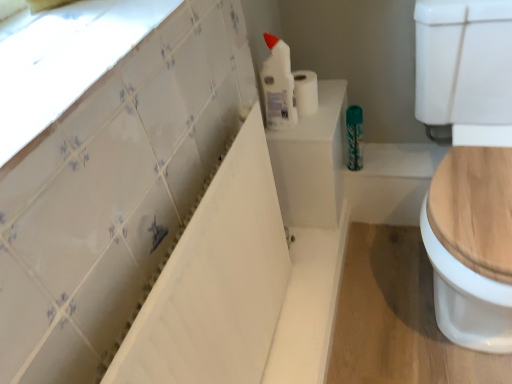
Where is `free spot above white glossy tile at upper left (from a real-world perspective)`? This screenshot has width=512, height=384. free spot above white glossy tile at upper left (from a real-world perspective) is located at coordinates (73, 44).